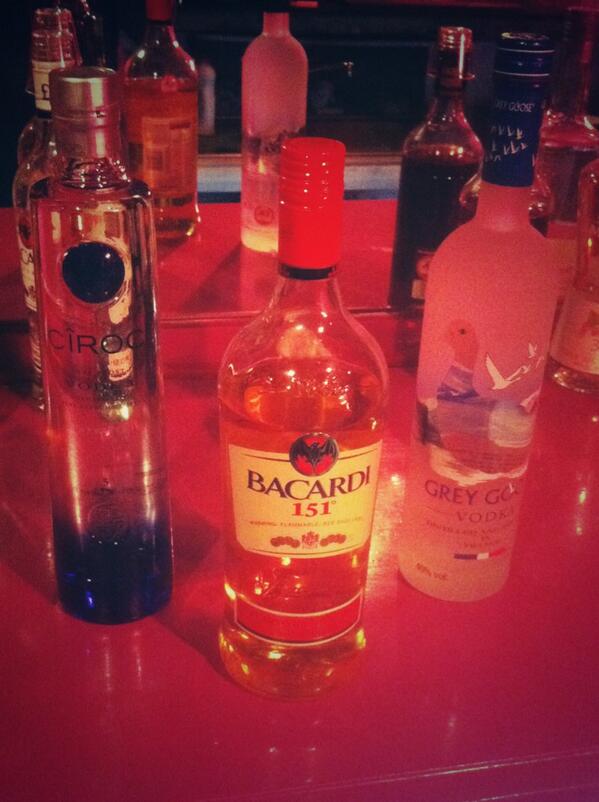
The height and width of the screenshot is (802, 599). I want to click on vodka bottle, so click(279, 88).